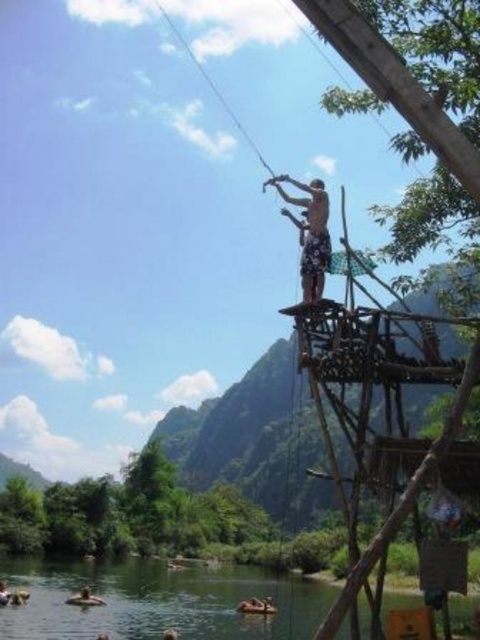
Question: Does tan skin man at center appear on the right side of blue sky at upper center?

Choices:
 (A) no
 (B) yes

Answer: (B)

Question: Considering the real-world distances, which object is closest to the brown leather backpack at lower left?

Choices:
 (A) brown wooden raft at lower center
 (B) tan skin man at center
 (C) greenish water at lower center
 (D) brown skin person at lower left

Answer: (D)

Question: Estimate the real-world distances between objects in this image. Which object is closer to the brown wooden raft at lower center?

Choices:
 (A) brown leather backpack at lower left
 (B) blue sky at upper center
 (C) tan skin man at center
 (D) brown skin person at lower left

Answer: (D)

Question: Among these objects, which one is nearest to the camera?

Choices:
 (A) greenish water at lower center
 (B) brown leather backpack at lower left
 (C) tan skin man at center
 (D) brown wooden raft at lower center

Answer: (A)

Question: Observing the image, what is the correct spatial positioning of blue sky at upper center in reference to brown skin person at lower left?

Choices:
 (A) above
 (B) below

Answer: (A)

Question: Considering the relative positions of blue sky at upper center and brown skin person at lower left in the image provided, where is blue sky at upper center located with respect to brown skin person at lower left?

Choices:
 (A) below
 (B) above

Answer: (B)